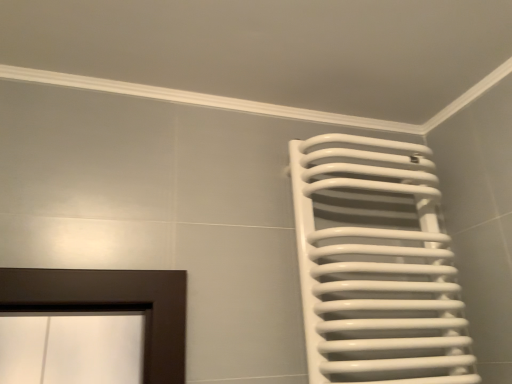
Find the location of a particular element. white glossy towel rack at right is located at coordinates (376, 265).

Describe the element at coordinates (376, 265) in the screenshot. I see `white glossy towel rack at right` at that location.

Consider the image. In order to face white glossy towel rack at right, should I rotate leftwards or rightwards?

Turn right by 16.563 degrees to look at white glossy towel rack at right.

What is the approximate width of white glossy towel rack at right?

white glossy towel rack at right is 6.36 inches wide.

The image size is (512, 384). I want to click on white glossy towel rack at right, so click(376, 265).